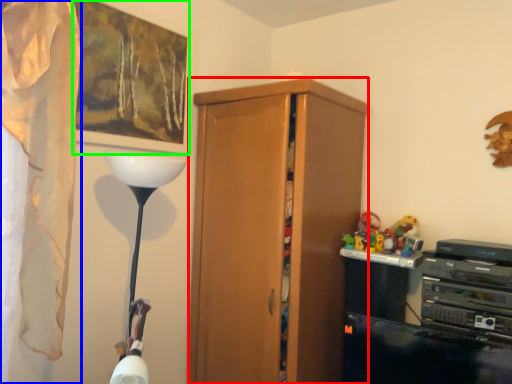
Question: Considering the real-world distances, which object is closest to cabinetry (highlighted by a red box)? curtain (highlighted by a blue box) or picture frame (highlighted by a green box).

Choices:
 (A) curtain
 (B) picture frame

Answer: (B)